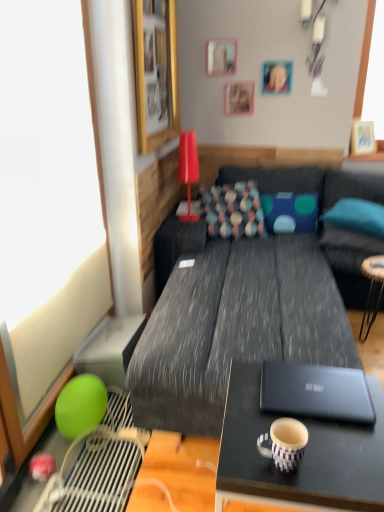
This screenshot has height=512, width=384. Identify the location of empty space that is ontop of matte black laptop at lower right, marked as the 2th table in a right-to-left arrangement (from a real-world perspective). coord(314,416).